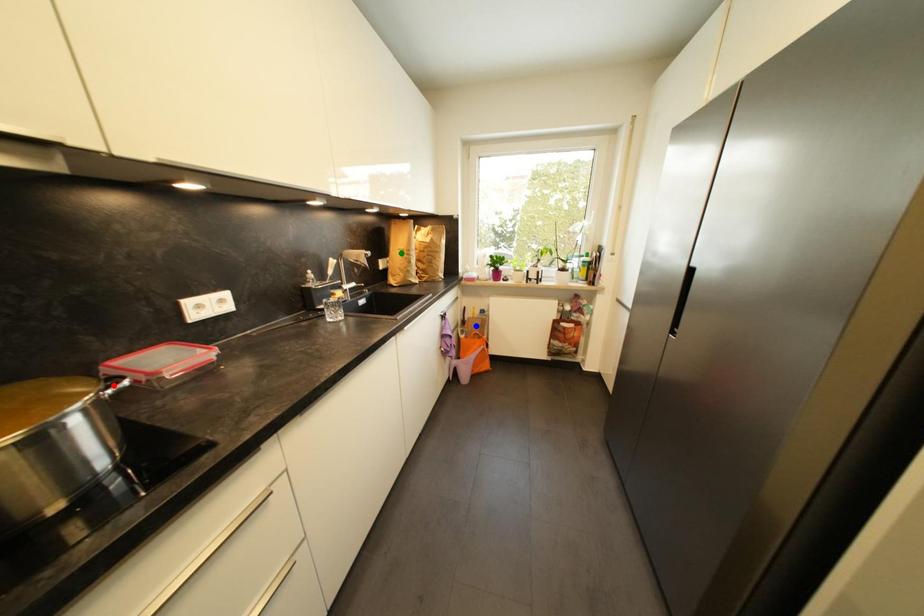
Order these from nearest to farthest:
A) red point
B) green point
C) blue point

blue point → green point → red point